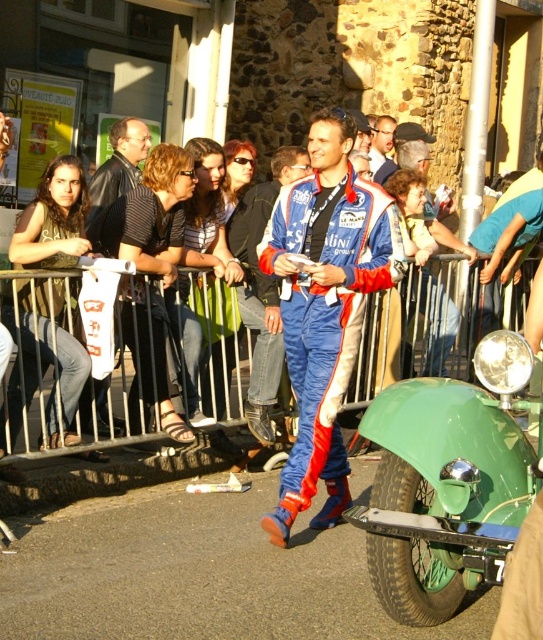
Can you confirm if blue/white racing suit at center is shorter than blue racing suit at center?

No.

Is blue/white racing suit at center thinner than blue racing suit at center?

Incorrect, blue/white racing suit at center's width is not less than blue racing suit at center's.

You are a GUI agent. You are given a task and a screenshot of the screen. Output one action in this format:
    pyautogui.click(x=<x>, y=<y>)
    Task: Click on the blue/white racing suit at center
    Image resolution: width=543 pixels, height=640 pixels.
    Given the screenshot: What is the action you would take?
    pyautogui.click(x=325, y=307)

Find the location of a particular element. blue/white racing suit at center is located at coordinates (325, 307).

Who is taller, blue racing suit at center or blue fabric racing suit at center?

Standing taller between the two is blue racing suit at center.

Measure the distance between point (276, 294) and camera.

Point (276, 294) and camera are 22.52 feet apart.

Image resolution: width=543 pixels, height=640 pixels. In order to click on blue racing suit at center in this screenshot , I will do `click(262, 285)`.

Image resolution: width=543 pixels, height=640 pixels. What are the coordinates of `blue racing suit at center` in the screenshot? It's located at (262, 285).

Which is below, blue/white racing suit at center or blue fabric racing suit at center?

blue/white racing suit at center

I want to click on blue/white racing suit at center, so click(x=325, y=307).